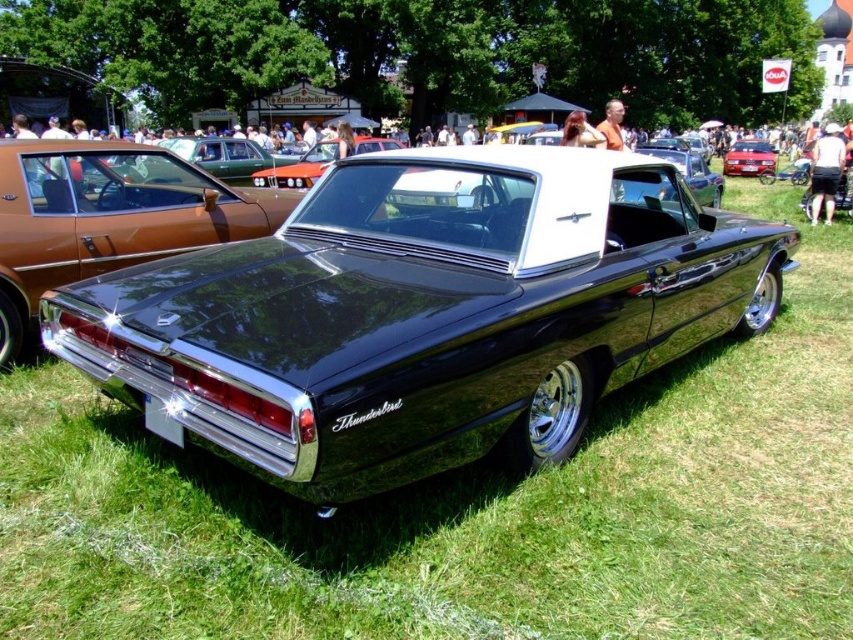
You are standing in a grassy field at a car show and see the shiny black thunderbird at center. If you take one step forward, will you be closer than 7 feet to the car?

The shiny black thunderbird at center is 7.83 feet from viewer. Taking one step forward would reduce the distance, but it depends on the step length. Assuming an average step is about 2.5 feet, stepping forward once would bring you to 5.33 feet, which is closer than 7 feet.

You are a photographer at the car show and want to capture both the shiny black thunderbird at center and the metallic red car at center in a single frame. Which car should you position closer to the camera to ensure both are fully visible in the photo?

To ensure both the shiny black thunderbird at center and the metallic red car at center are fully visible in the photo, position the metallic red car at center closer to the camera since it is shorter than the shiny black thunderbird at center.

You are standing at the center of the grassy field and see the shiny black thunderbird at center. If you walk straight ahead, will you collide with the car?

The shiny black thunderbird at center is located at point [422,314], which is very close to the center of the field. Since you are already at the center, walking straight ahead might lead you towards the car, so there is a risk of collision. You should check the distance carefully before moving forward.